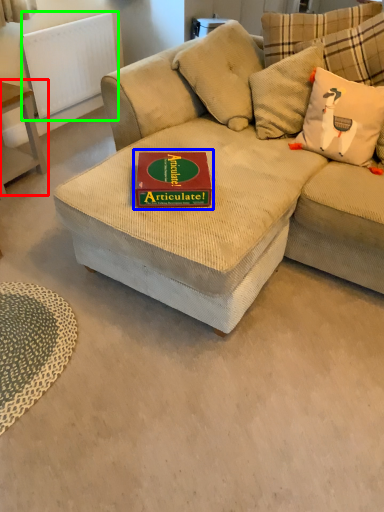
Question: Which object is positioned closest to table (highlighted by a red box)? Select from paperback book (highlighted by a blue box) and radiator (highlighted by a green box).

Choices:
 (A) paperback book
 (B) radiator

Answer: (B)